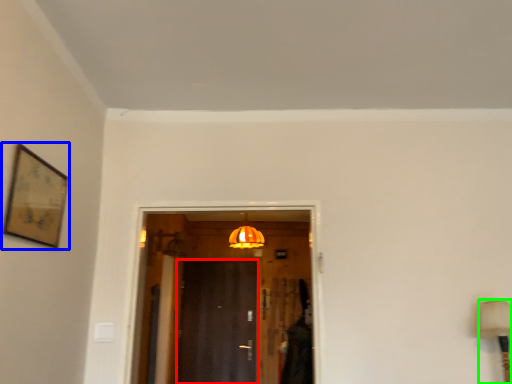
Question: Which object is the farthest from door (highlighted by a red box)? Choose among these: picture frame (highlighted by a blue box) or table lamp (highlighted by a green box).

Choices:
 (A) picture frame
 (B) table lamp

Answer: (A)